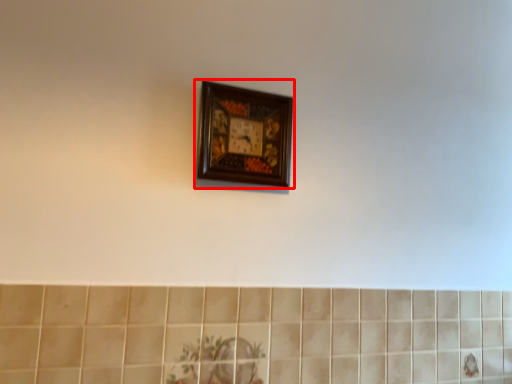
Question: Considering the relative positions of picture frame (annotated by the red box) and ceramic tile in the image provided, where is picture frame (annotated by the red box) located with respect to the staircase?

Choices:
 (A) left
 (B) right

Answer: (A)